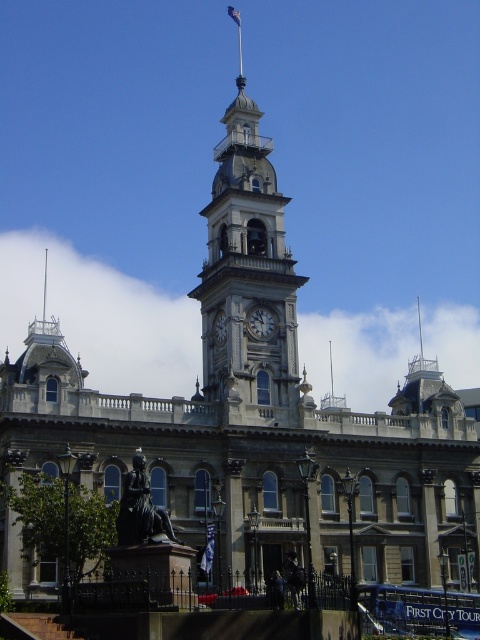
Question: Which object appears farthest from the camera in this image?

Choices:
 (A) polished brass clock tower at center
 (B) silver metallic clock at center

Answer: (B)

Question: Which object appears farthest from the camera in this image?

Choices:
 (A) blue fabric flag at lower center
 (B) polished brass clock tower at center
 (C) white glossy clock at center

Answer: (C)

Question: Does white glossy clock at center come in front of silver metallic clock at center?

Choices:
 (A) yes
 (B) no

Answer: (A)

Question: Is polished brass clock tower at center positioned at the back of silver metallic clock at center?

Choices:
 (A) no
 (B) yes

Answer: (A)

Question: Among these objects, which one is farthest from the camera?

Choices:
 (A) white glossy clock at center
 (B) silver metallic clock at center
 (C) white fabric flag at top-center
 (D) blue fabric flag at lower center

Answer: (C)

Question: Is white glossy clock at center closer to camera compared to white fabric flag at top-center?

Choices:
 (A) yes
 (B) no

Answer: (A)